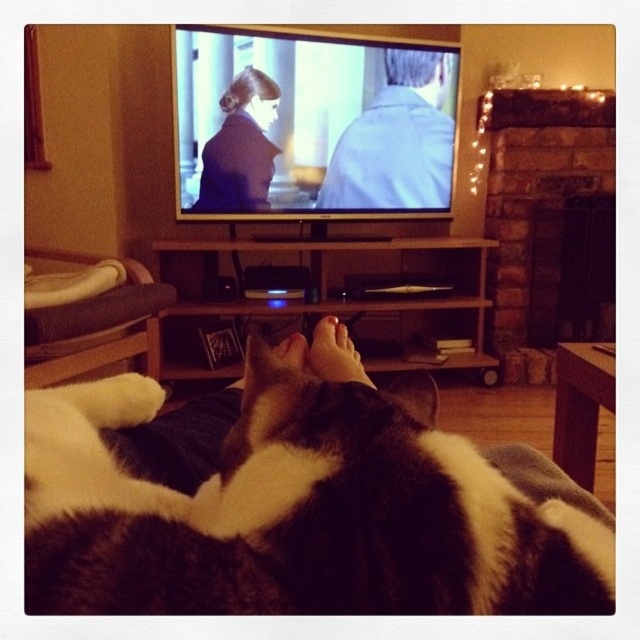
Can you confirm if black and white fur at lower center is taller than matte skin foot at center?

Yes.

Measure the distance between black and white fur at lower center and camera.

A distance of 9.52 inches exists between black and white fur at lower center and camera.

You are a GUI agent. You are given a task and a screenshot of the screen. Output one action in this format:
    pyautogui.click(x=<x>, y=<y>)
    Task: Click on the black and white fur at lower center
    
    Given the screenshot: What is the action you would take?
    pyautogui.click(x=296, y=513)

Describe the element at coordinates (296, 513) in the screenshot. I see `black and white fur at lower center` at that location.

Does black and white fur at lower center have a smaller size compared to light blue shirt at upper center?

Indeed, black and white fur at lower center has a smaller size compared to light blue shirt at upper center.

Between point (396, 408) and point (362, 168), which one is positioned in front?

Point (396, 408) is more forward.

The width and height of the screenshot is (640, 640). What are the coordinates of `black and white fur at lower center` in the screenshot? It's located at (296, 513).

Does point (296, 572) come closer to viewer compared to point (218, 172)?

Yes, it is in front of point (218, 172).

Is black and white fur at lower center thinner than matte black coat at upper left?

In fact, black and white fur at lower center might be wider than matte black coat at upper left.

Where is `black and white fur at lower center`? black and white fur at lower center is located at coordinates (296, 513).

Find the location of a particular element. Image resolution: width=640 pixels, height=640 pixels. black and white fur at lower center is located at coordinates (296, 513).